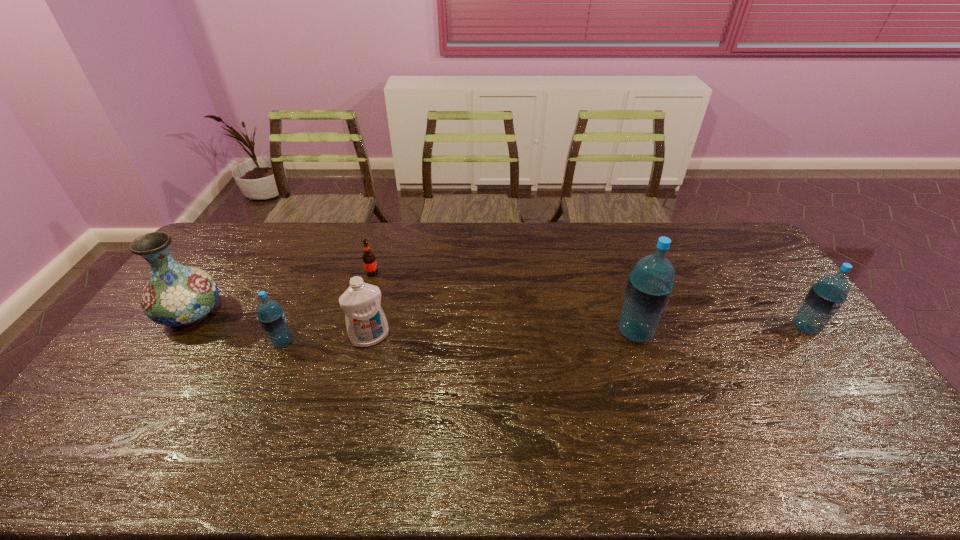
Find the location of a particular element. Image resolution: width=960 pixels, height=540 pixels. empty space that is in between the detergent and the second tallest water bottle is located at coordinates (588, 333).

Locate an element on the screen. This screenshot has height=540, width=960. empty space that is in between the leftmost water bottle and the rightmost water bottle is located at coordinates (544, 335).

Identify the location of vacant area that lies between the second shortest object and the farthest object. This screenshot has height=540, width=960. (327, 307).

Identify which object is the fourth closest to the detergent. Please provide its 2D coordinates. Your answer should be formatted as a tuple, i.e. [(x, y)], where the tuple contains the x and y coordinates of a point satisfying the conditions above.

[(650, 284)]

You are a GUI agent. You are given a task and a screenshot of the screen. Output one action in this format:
    pyautogui.click(x=<x>, y=<y>)
    Task: Click on the object that is the closest to the detergent
    This screenshot has width=960, height=540.
    Given the screenshot: What is the action you would take?
    pyautogui.click(x=271, y=316)

Locate which water bottle ranks in proximity to the rightmost water bottle. Please provide its 2D coordinates. Your answer should be formatted as a tuple, i.e. [(x, y)], where the tuple contains the x and y coordinates of a point satisfying the conditions above.

[(650, 284)]

Identify which water bottle is the closest to the rightmost water bottle. Please provide its 2D coordinates. Your answer should be formatted as a tuple, i.e. [(x, y)], where the tuple contains the x and y coordinates of a point satisfying the conditions above.

[(650, 284)]

Locate an element on the screen. blank area in the image that satisfies the following two spatial constraints: 1. on the back side of the fifth object from left to right; 2. on the right side of the detergent is located at coordinates 372,332.

Find the location of `free space that satisfies the following two spatial constraints: 1. on the front side of the leftmost object; 2. on the right side of the second tallest water bottle`. free space that satisfies the following two spatial constraints: 1. on the front side of the leftmost object; 2. on the right side of the second tallest water bottle is located at coordinates (182, 328).